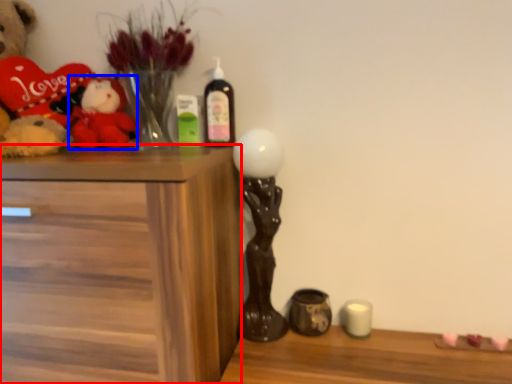
Question: Which object appears farthest to the camera in this image, chest of drawers (highlighted by a red box) or toy (highlighted by a blue box)?

Choices:
 (A) chest of drawers
 (B) toy

Answer: (B)